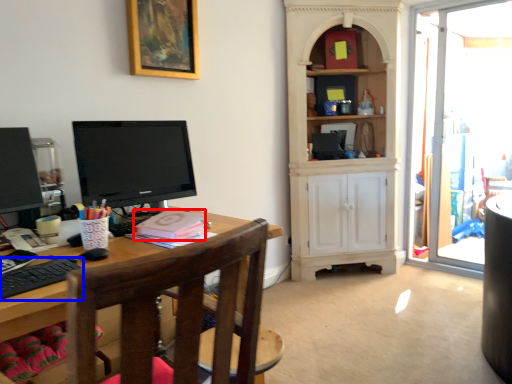
Question: Among these objects, which one is nearest to the camera, book (highlighted by a red box) or computer keyboard (highlighted by a blue box)?

Choices:
 (A) book
 (B) computer keyboard

Answer: (B)